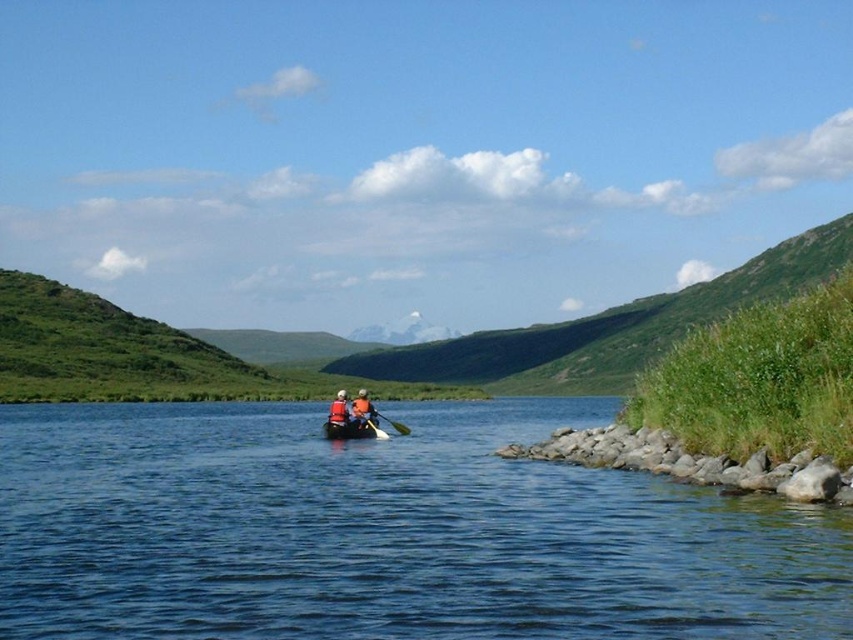
Does black plastic paddle at center have a greater width compared to wooden paddle at center?

Yes, black plastic paddle at center is wider than wooden paddle at center.

You are a GUI agent. You are given a task and a screenshot of the screen. Output one action in this format:
    pyautogui.click(x=<x>, y=<y>)
    Task: Click on the black plastic paddle at center
    
    Given the screenshot: What is the action you would take?
    pyautogui.click(x=392, y=422)

Between white plastic canoe at center and orange life jacket at center, which one has less height?

white plastic canoe at center is shorter.

Image resolution: width=853 pixels, height=640 pixels. What do you see at coordinates (352, 429) in the screenshot?
I see `white plastic canoe at center` at bounding box center [352, 429].

Find the location of a particular element. white plastic canoe at center is located at coordinates (352, 429).

Can you confirm if white plastic canoe at center is shorter than wooden paddle at center?

Yes, white plastic canoe at center is shorter than wooden paddle at center.

Between white plastic canoe at center and wooden paddle at center, which one is positioned higher?

wooden paddle at center

This screenshot has width=853, height=640. In order to click on white plastic canoe at center in this screenshot , I will do `click(352, 429)`.